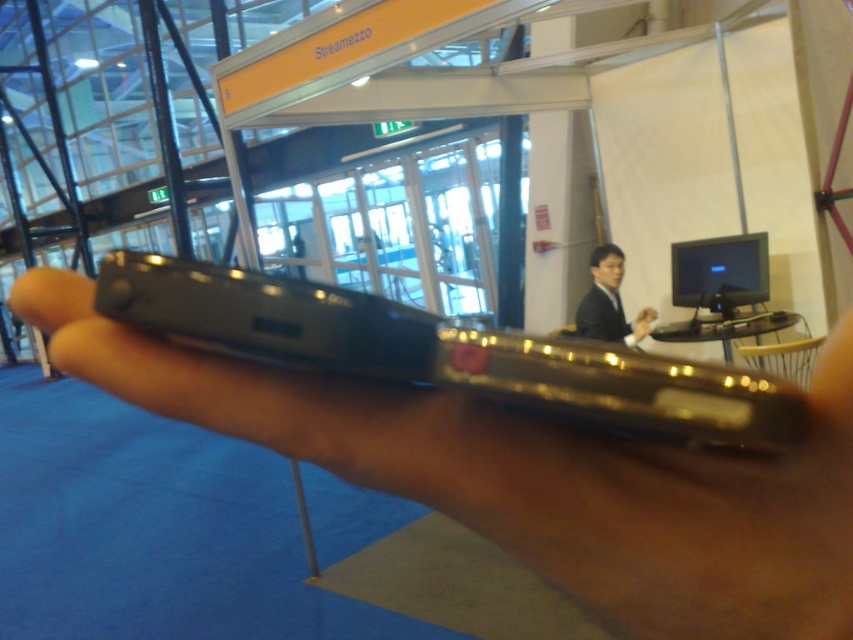
In the scene shown: You are at the Streamazzo booth and need to place both the black matte phone at center and the black suit at center on a shelf. The shelf has limited space. Which item should you place first to ensure both fit?

The black matte phone at center has a smaller size compared to the black suit at center, so you should place the black suit at center first to accommodate its larger size, then the phone will fit alongside.

You are holding a black device in your hand and want to place it on the table at point (x=740, y=522). The device is 4 inches long. Can you fit it horizontally on the table at that point without it hanging off?

The distance between the point (x=740, y=522) and the camera is 9.10 inches. Since the device is 4 inches long, it can fit horizontally at that point as the available space is more than the device length.

You are setting up a display table and need to place both the black matte phone at center and the black suit at center. Since the table has limited space, which item should you place first to ensure both fit comfortably?

The black matte phone at center has a smaller width than the black suit at center, so you should place the black suit at center first to accommodate its larger size, then fit the black matte phone at center next to it.